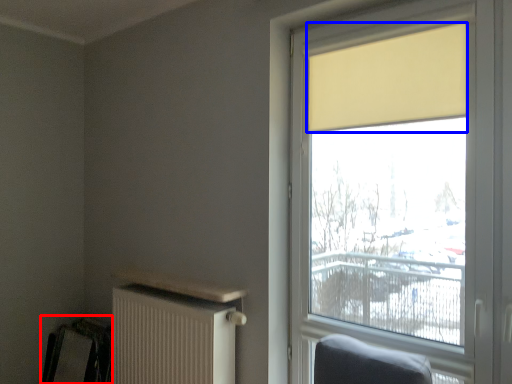
Question: Which object is closer to the camera taking this photo, swivel chair (highlighted by a red box) or curtain (highlighted by a blue box)?

Choices:
 (A) swivel chair
 (B) curtain

Answer: (B)